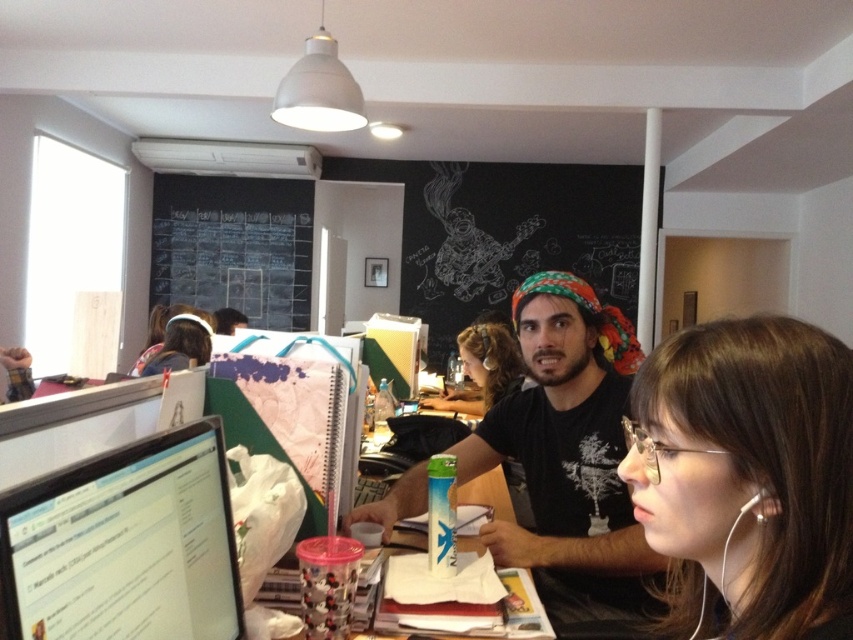
Does black chalkboard at upper center appear under matte black hair at upper left?

No.

The width and height of the screenshot is (853, 640). In order to click on black chalkboard at upper center in this screenshot , I will do `click(234, 246)`.

What are the coordinates of `black chalkboard at upper center` in the screenshot? It's located at (234, 246).

Does black t-shirt at center have a lesser height compared to matte black monitor at left?

Incorrect, black t-shirt at center's height does not fall short of matte black monitor at left's.

Which of these two, black t-shirt at center or matte black monitor at left, stands shorter?

matte black monitor at left

The image size is (853, 640). What are the coordinates of `black t-shirt at center` in the screenshot? It's located at (567, 456).

Where is `black t-shirt at center`? black t-shirt at center is located at coordinates (567, 456).

Between point (838, 620) and point (213, 330), which one is positioned behind?

Positioned behind is point (213, 330).

Where is `brown hair at center`? brown hair at center is located at coordinates (747, 476).